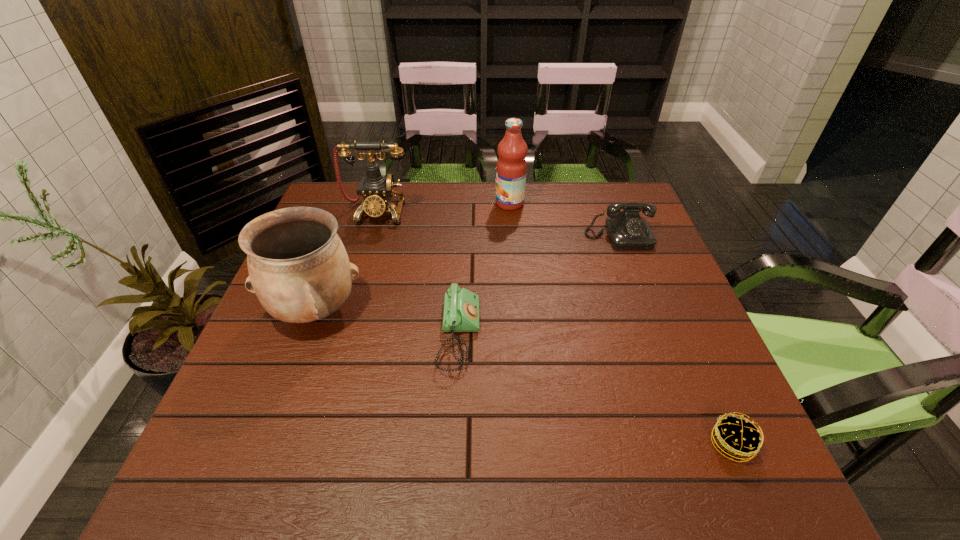
Locate an element on the screen. The width and height of the screenshot is (960, 540). telephone positioned at the right edge is located at coordinates (627, 230).

Where is `patty at the right edge`? This screenshot has height=540, width=960. patty at the right edge is located at coordinates (738, 438).

The image size is (960, 540). In order to click on object present at the far left corner in this screenshot , I will do `click(376, 190)`.

This screenshot has height=540, width=960. Identify the location of object located at the far right corner. (627, 230).

What are the coordinates of `object positioned at the near right corner` in the screenshot? It's located at (738, 438).

This screenshot has height=540, width=960. Find the location of `free space at the far edge of the desktop`. free space at the far edge of the desktop is located at coordinates (425, 184).

Find the location of a particular element. This screenshot has height=540, width=960. vacant area at the near edge of the desktop is located at coordinates (582, 457).

Where is `vacant space at the left edge of the desktop`? vacant space at the left edge of the desktop is located at coordinates (282, 396).

Find the location of a particular element. vacant space at the right edge of the desktop is located at coordinates (695, 441).

Where is `free space at the far left corner`? free space at the far left corner is located at coordinates (334, 210).